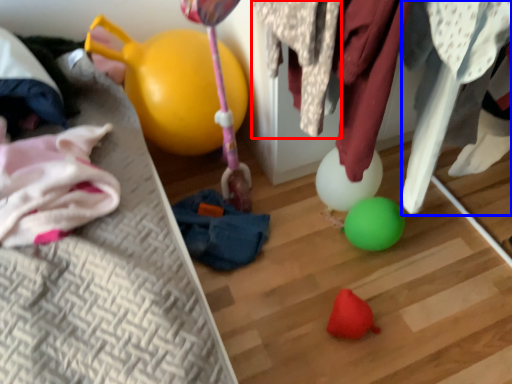
Question: Which object appears closest to the camera in this image, clothing (highlighted by a red box) or clothing (highlighted by a blue box)?

Choices:
 (A) clothing
 (B) clothing

Answer: (A)